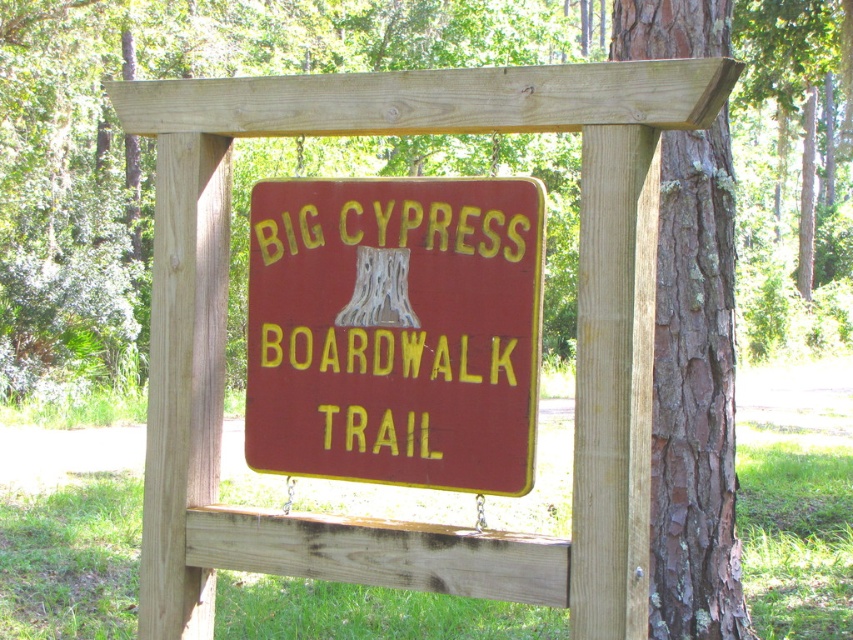
Question: From the image, what is the correct spatial relationship of brown rough bark tree at center in relation to brown rough bark at right?

Choices:
 (A) above
 (B) below

Answer: (A)

Question: Can you confirm if brown rough bark tree at center is positioned to the right of brown rough bark at right?

Choices:
 (A) no
 (B) yes

Answer: (B)

Question: Which of the following is the farthest from the observer?

Choices:
 (A) (329, 156)
 (B) (674, 392)
 (C) (393, 227)

Answer: (A)

Question: Estimate the real-world distances between objects in this image. Which object is farther from the matte red sign at center?

Choices:
 (A) brown rough bark at right
 (B) brown rough bark tree at center

Answer: (B)

Question: Does brown rough bark tree at center have a smaller size compared to matte red sign at center?

Choices:
 (A) yes
 (B) no

Answer: (B)

Question: Which object appears farthest from the camera in this image?

Choices:
 (A) brown rough bark tree at center
 (B) matte red sign at center

Answer: (A)